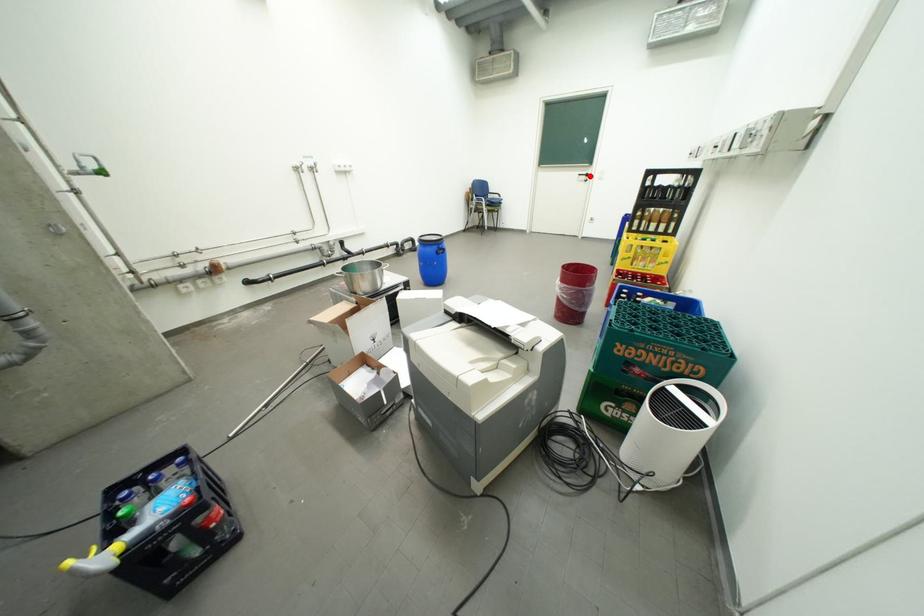
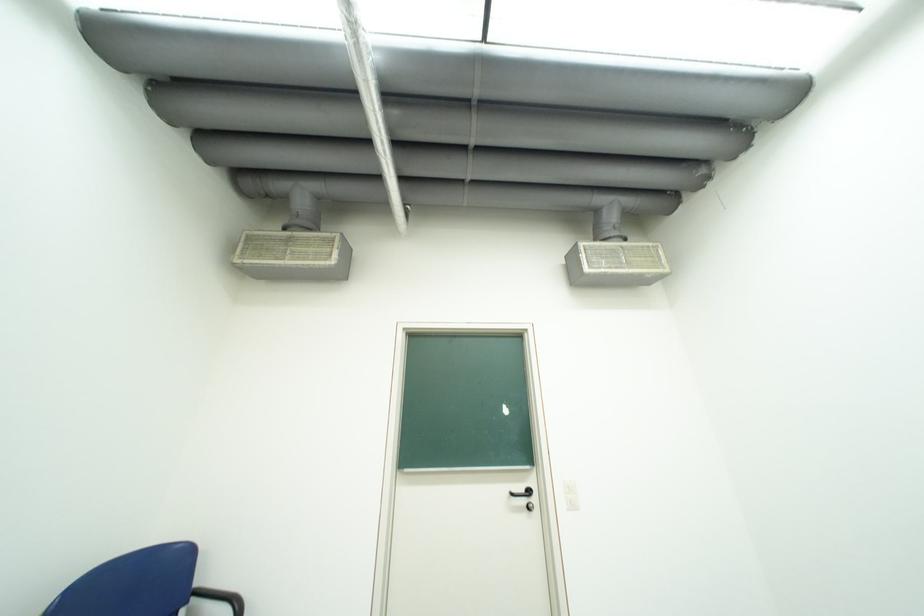
Question: I am providing you with two images of the same scene from different viewpoints. A red point is shown in image1. For the corresponding object point in image2, is it positioned nearer or farther from the camera?

Choices:
 (A) Nearer
 (B) Farther

Answer: (B)